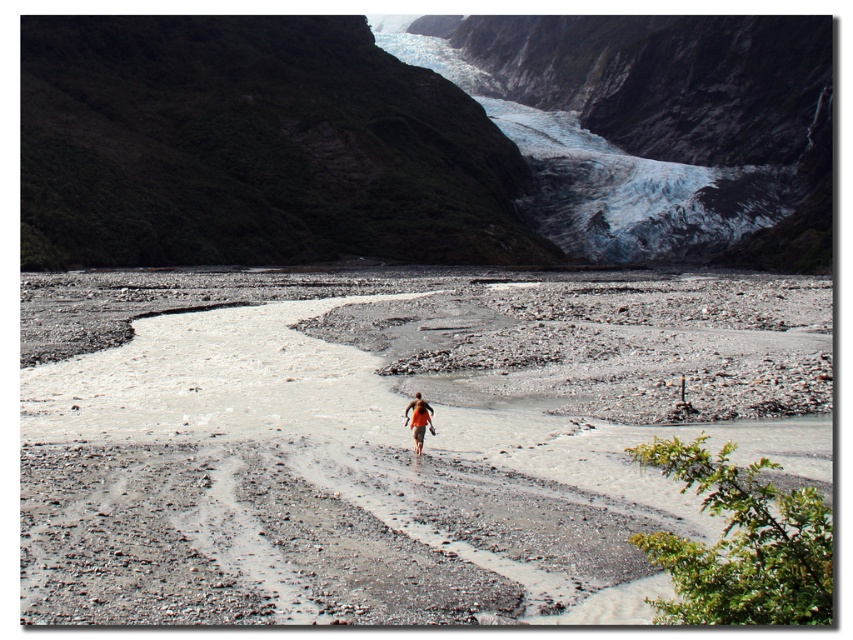
Between green mossy rock at upper left and orange fabric person at center, which one has more height?

green mossy rock at upper left is taller.

Who is shorter, green mossy rock at upper left or orange fabric person at center?

With less height is orange fabric person at center.

At what (x,y) coordinates should I click in order to perform the action: click on green mossy rock at upper left. Please return your answer as a coordinate pair (x, y). The width and height of the screenshot is (853, 640). Looking at the image, I should click on (254, 147).

Which is above, gray gravel riverbed at center or blue ice glacier at upper center?

blue ice glacier at upper center

Can you confirm if gray gravel riverbed at center is thinner than blue ice glacier at upper center?

Correct, gray gravel riverbed at center's width is less than blue ice glacier at upper center's.

The width and height of the screenshot is (853, 640). Describe the element at coordinates (392, 436) in the screenshot. I see `gray gravel riverbed at center` at that location.

Locate an element on the screen. gray gravel riverbed at center is located at coordinates (392, 436).

Based on the photo, which is more to the left, gray gravel riverbed at center or orange fabric person at center?

Positioned to the left is orange fabric person at center.

Does gray gravel riverbed at center have a greater height compared to orange fabric person at center?

Yes.

At what (x,y) coordinates should I click in order to perform the action: click on gray gravel riverbed at center. Please return your answer as a coordinate pair (x, y). Image resolution: width=853 pixels, height=640 pixels. Looking at the image, I should click on (392, 436).